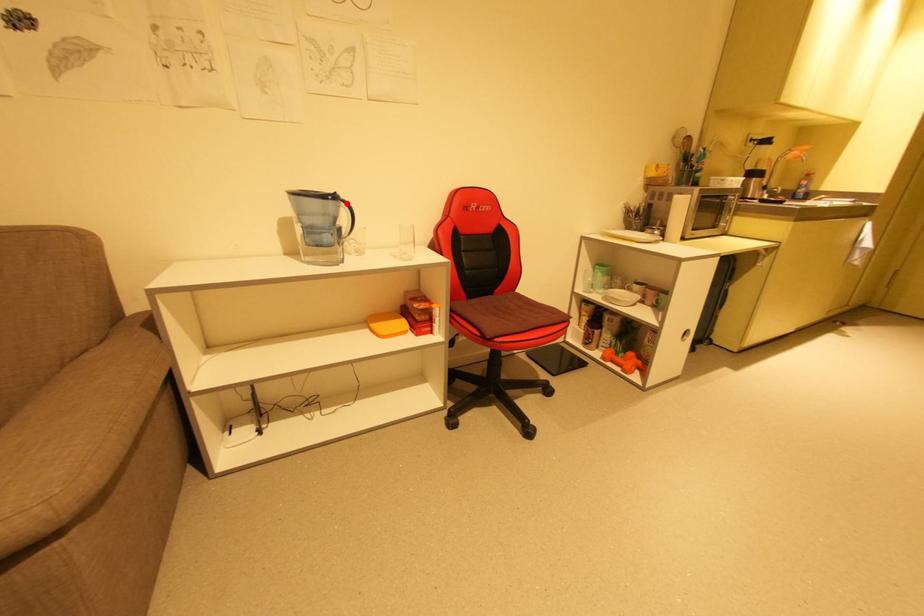
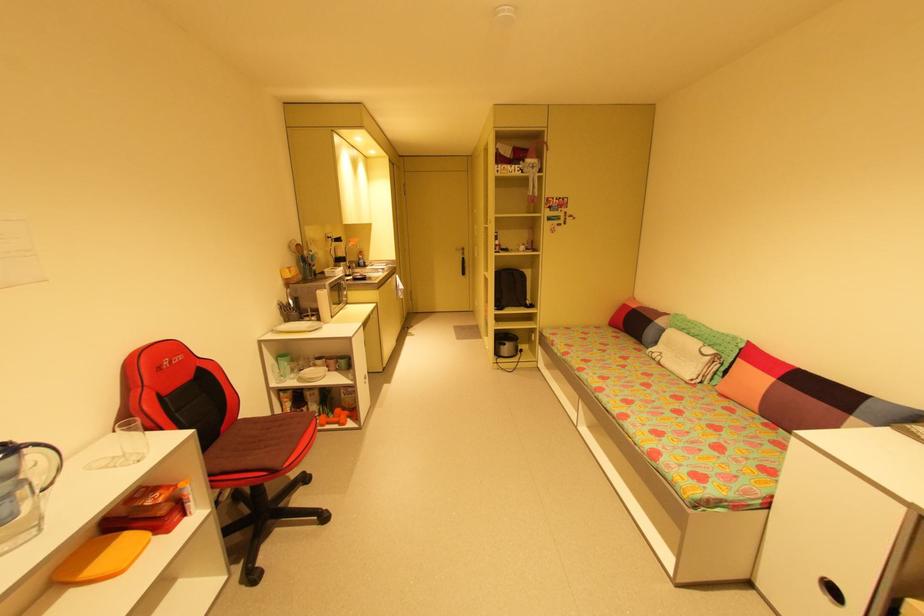
The point at the highlighted location is marked in the first image. Where is the corresponding point in the second image?

(30, 450)